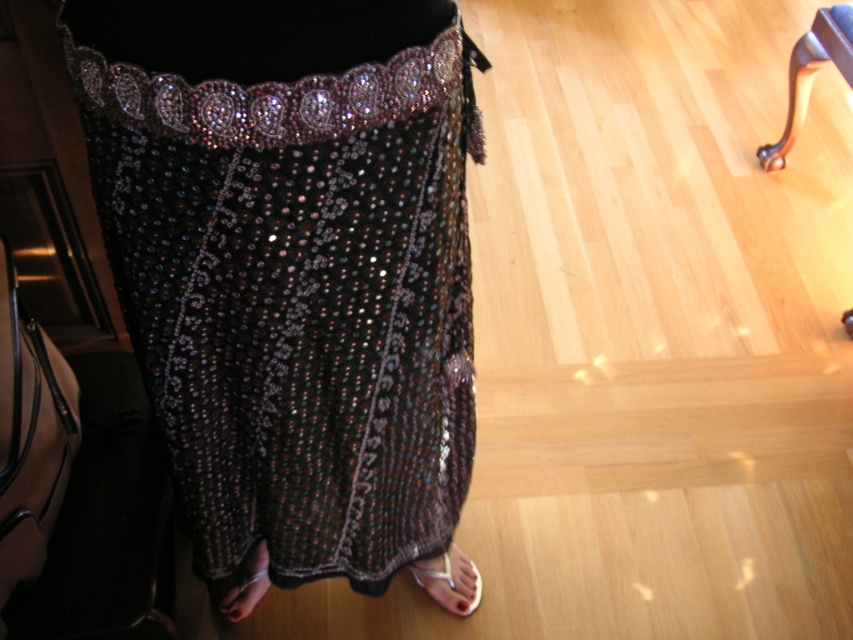
Question: Among these objects, which one is nearest to the camera?

Choices:
 (A) metallic silver sandal at lower center
 (B) shiny sequined dress at center
 (C) polished wood leg at upper right

Answer: (B)

Question: Estimate the real-world distances between objects in this image. Which object is farther from the metallic silver sandal at lower center?

Choices:
 (A) shiny sequined dress at center
 (B) polished wood leg at upper right
 (C) shiny metallic sandal at lower center

Answer: (B)

Question: Is shiny sequined dress at center smaller than polished wood leg at upper right?

Choices:
 (A) yes
 (B) no

Answer: (B)

Question: Can you confirm if shiny sequined dress at center is bigger than metallic silver sandal at lower center?

Choices:
 (A) yes
 (B) no

Answer: (A)

Question: Among these points, which one is farthest from the camera?

Choices:
 (A) 434,570
 (B) 850,22
 (C) 247,248

Answer: (B)

Question: Can you confirm if polished wood leg at upper right is thinner than metallic silver sandal at lower center?

Choices:
 (A) yes
 (B) no

Answer: (A)